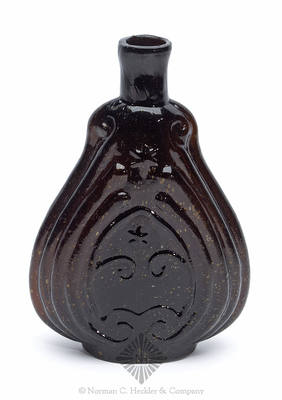
You are a GUI agent. You are given a task and a screenshot of the screen. Output one action in this format:
    pyautogui.click(x=<x>, y=<y>)
    Task: Click on the blown glass
    
    Given the screenshot: What is the action you would take?
    pyautogui.click(x=211, y=254)